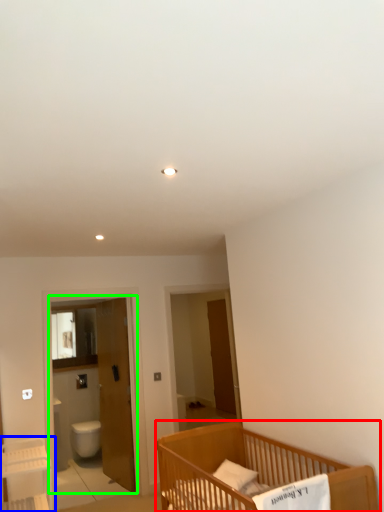
Question: Estimate the real-world distances between objects in this image. Which object is closer to infant bed (highlighted by a red box), table (highlighted by a blue box) or screen door (highlighted by a green box)?

Choices:
 (A) table
 (B) screen door

Answer: (A)